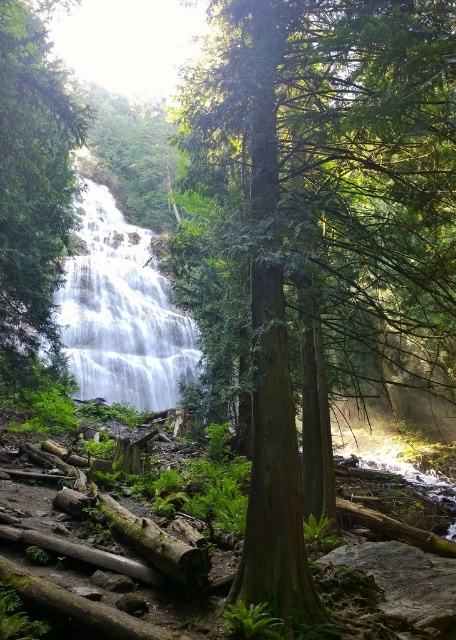
Question: Based on their relative distances, which object is nearer to the green matte tree at left?

Choices:
 (A) green smooth tree at center
 (B) white smooth waterfall at center

Answer: (A)

Question: Can you confirm if green smooth tree at center is bigger than green matte tree at left?

Choices:
 (A) yes
 (B) no

Answer: (A)

Question: Is green smooth tree at center to the left of green matte tree at left from the viewer's perspective?

Choices:
 (A) no
 (B) yes

Answer: (A)

Question: Which point is closer to the camera taking this photo?

Choices:
 (A) (93, 282)
 (B) (16, 131)
 (C) (332, 321)

Answer: (B)

Question: Can you confirm if green smooth tree at center is bigger than white smooth waterfall at center?

Choices:
 (A) yes
 (B) no

Answer: (B)

Question: Among these objects, which one is farthest from the camera?

Choices:
 (A) green smooth tree at center
 (B) green matte tree at left
 (C) white smooth waterfall at center

Answer: (C)